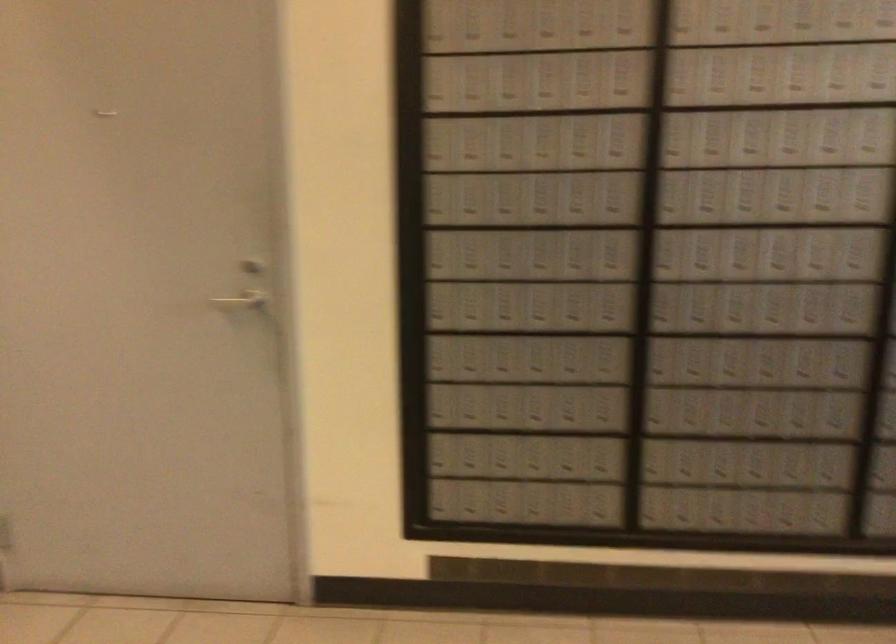
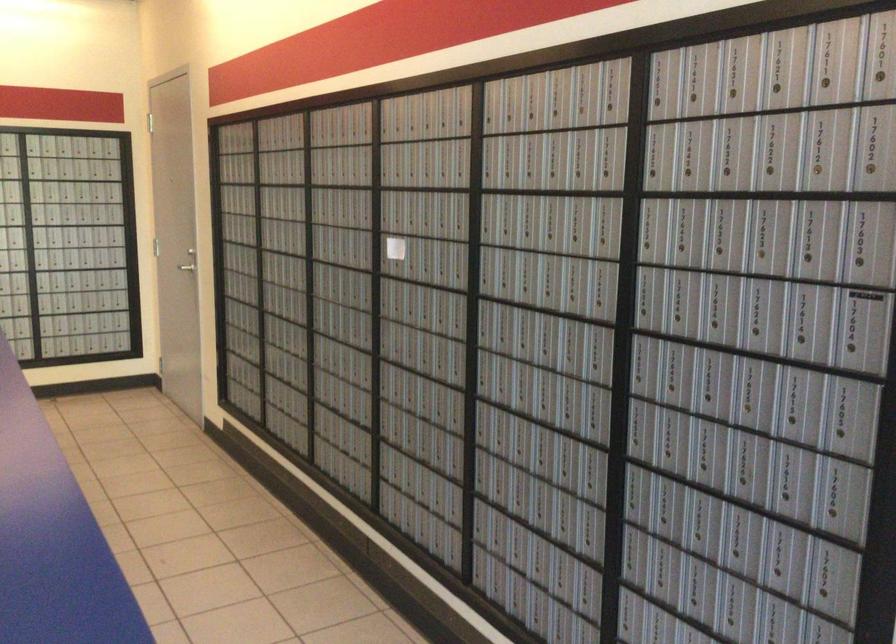
Where in the second image is the point corresponding to point (254, 292) from the first image?

(188, 261)